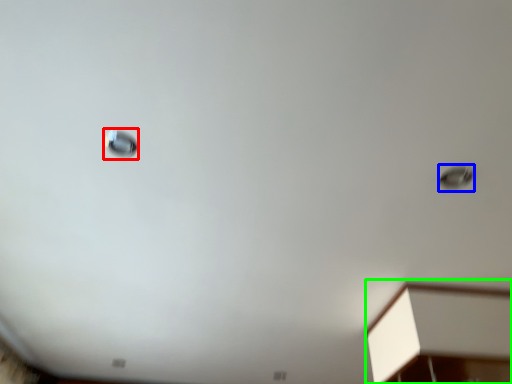
Question: Which is nearer to the droplight (highlighted by a red box)? droplight (highlighted by a blue box) or furniture (highlighted by a green box).

Choices:
 (A) droplight
 (B) furniture

Answer: (A)